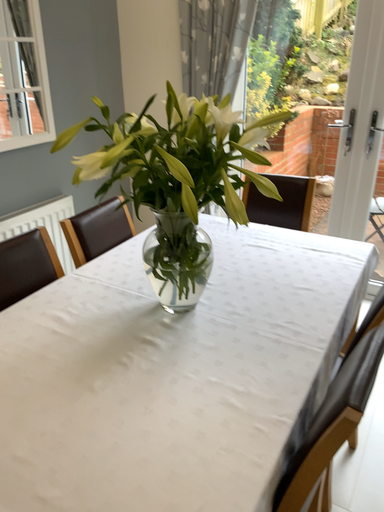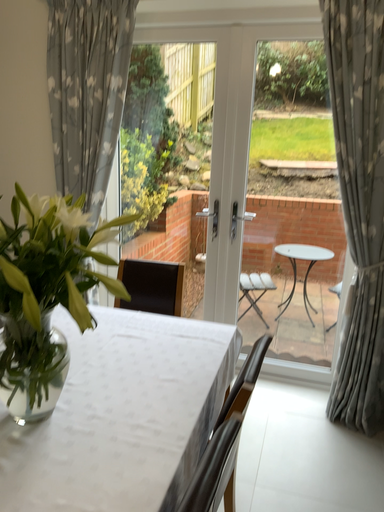
Question: How did the camera likely rotate when shooting the video?

Choices:
 (A) rotated left
 (B) rotated right

Answer: (B)